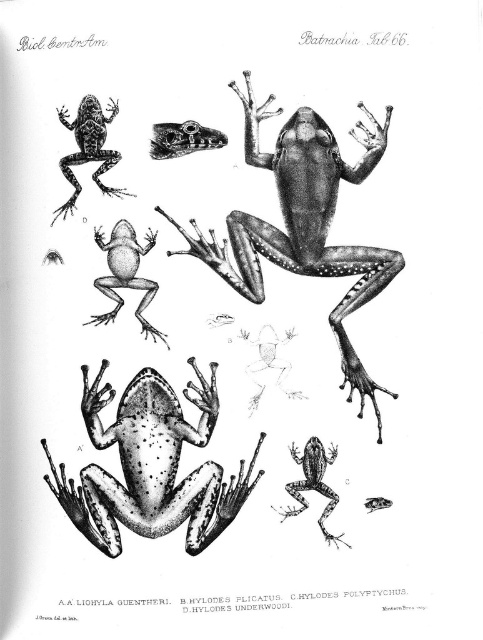
Does smooth black frog at center appear under smooth black skull at upper center?

Correct, smooth black frog at center is located below smooth black skull at upper center.

Between smooth black frog at center and smooth black skull at upper center, which one appears on the left side from the viewer's perspective?

smooth black skull at upper center

This screenshot has width=483, height=640. What are the coordinates of `smooth black frog at center` in the screenshot? It's located at (304, 224).

Does speckled matte frog at center come behind speckled skin frog at lower right?

No, speckled matte frog at center is closer to the viewer.

From the picture: Is speckled matte frog at center thinner than speckled skin frog at lower right?

In fact, speckled matte frog at center might be wider than speckled skin frog at lower right.

Which is in front, point (90, 522) or point (316, 464)?

Point (90, 522)

The image size is (483, 640). Find the location of `speckled matte frog at center`. speckled matte frog at center is located at coordinates (151, 465).

Is point (142, 420) positioned after point (114, 241)?

That is True.

Based on the photo, is speckled matte frog at center closer to camera compared to smooth gray frog at center?

Yes, speckled matte frog at center is closer to the viewer.

Locate an element on the screen. Image resolution: width=483 pixels, height=640 pixels. speckled matte frog at center is located at coordinates (151, 465).